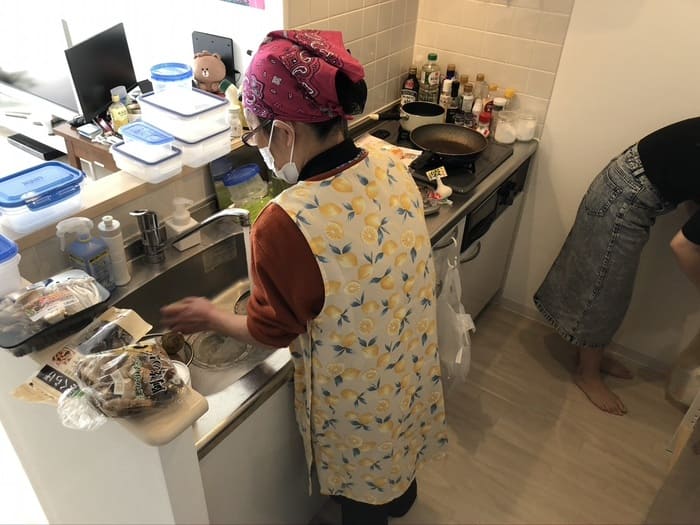
Locate an element on the screen. The height and width of the screenshot is (525, 700). food bottles is located at coordinates (414, 88), (421, 81), (447, 87), (463, 97), (483, 107), (498, 121), (518, 122), (509, 103), (500, 103).